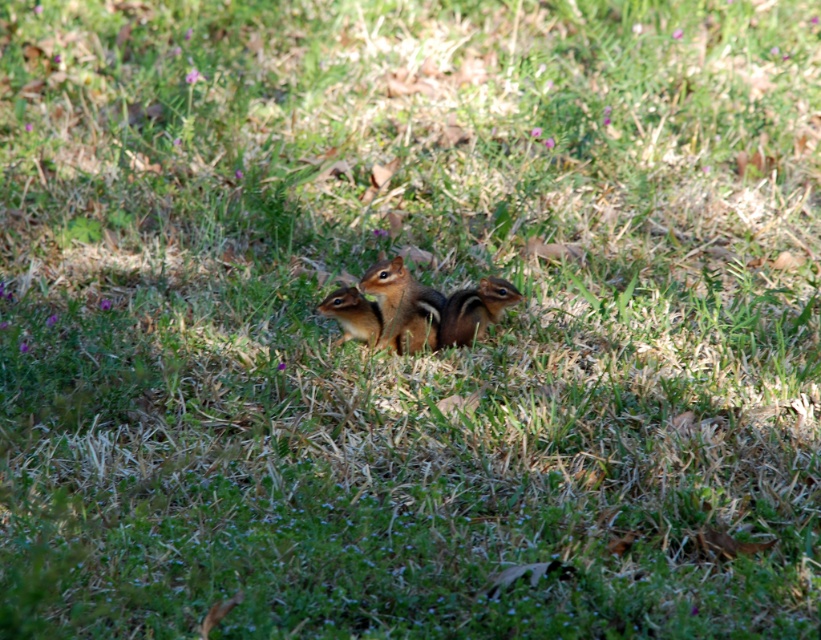
Consider the image. You are a photographer aiming to capture a closeup of the chipmunks in the scene. You notice two points of interest marked as point 1 at coordinates point (398, 324) and point 2 at coordinates point (333, 301). Which point is closer to your camera lens?

Point 1 at coordinates point (398, 324) is closer to the camera lens because it is further to the viewer than point 2 at coordinates point (333, 301).

Based on the coordinates provided in the scene, where is the brown furry squirrel at center located?

The brown furry squirrel at center is located at point (402, 305).